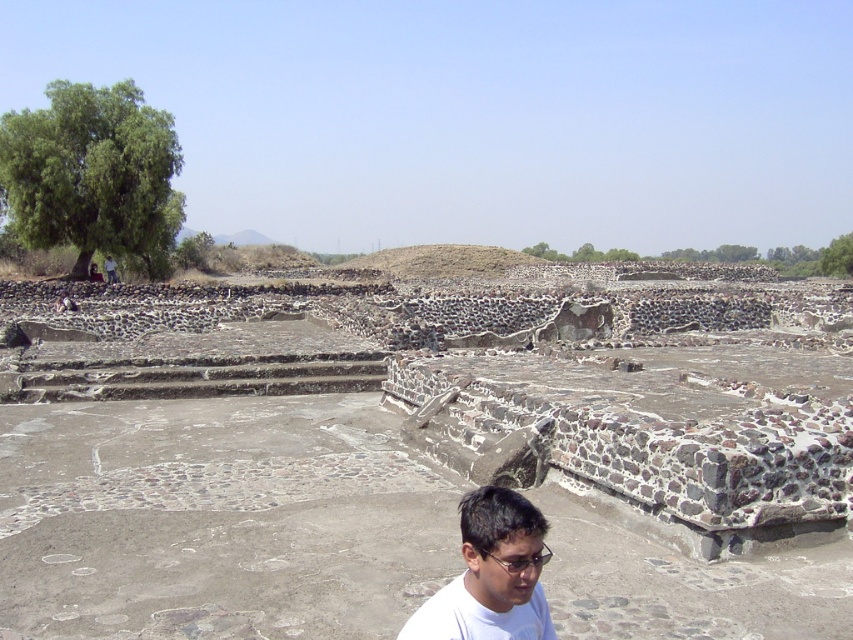
Question: Does white matte shirt at lower center appear under transparent plastic glasses at lower center?

Choices:
 (A) yes
 (B) no

Answer: (A)

Question: Can you confirm if green leafy tree at upper left is positioned above green leafy tree at upper right?

Choices:
 (A) no
 (B) yes

Answer: (A)

Question: Is green leafy tree at upper right smaller than matte gray stone figure at upper left?

Choices:
 (A) yes
 (B) no

Answer: (B)

Question: Which point is closer to the camera taking this photo?

Choices:
 (A) (105, 269)
 (B) (21, 220)

Answer: (B)

Question: Which point is farther to the camera?

Choices:
 (A) (111, 266)
 (B) (456, 616)
 (C) (42, 193)
 (D) (543, 557)

Answer: (A)

Question: Which object is positioned farthest from the green leafy tree at upper left?

Choices:
 (A) matte gray stone figure at upper left
 (B) white matte shirt at lower center
 (C) transparent plastic glasses at lower center

Answer: (C)